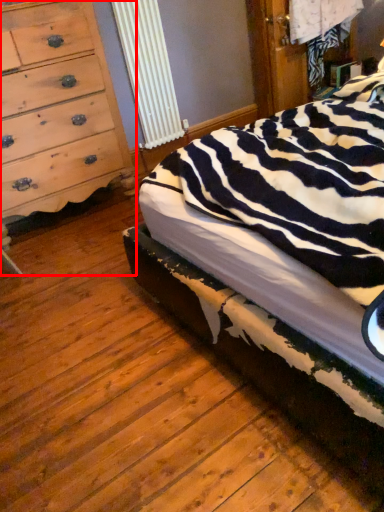
Question: From the image's perspective, what is the correct spatial positioning of chest of drawers (annotated by the red box) in reference to bed?

Choices:
 (A) below
 (B) above

Answer: (B)